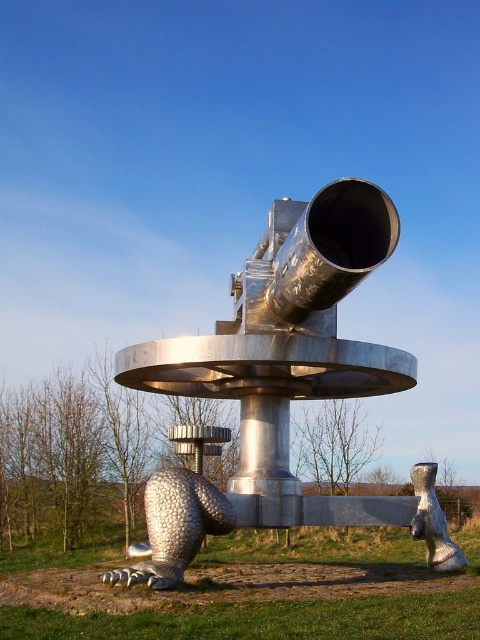
Question: Is metallic silver telescope at center smaller than silver textured bear at lower left?

Choices:
 (A) yes
 (B) no

Answer: (A)

Question: Does metallic silver telescope at center appear on the left side of silver textured bear at lower left?

Choices:
 (A) no
 (B) yes

Answer: (B)

Question: Which of the following is the farthest from the observer?

Choices:
 (A) (216, 628)
 (B) (310, 275)

Answer: (B)

Question: Among these objects, which one is nearest to the camera?

Choices:
 (A) silver textured bear at lower left
 (B) metallic silver telescope at center

Answer: (A)

Question: Can you confirm if metallic silver telescope at center is wider than silver textured bear at lower left?

Choices:
 (A) yes
 (B) no

Answer: (B)